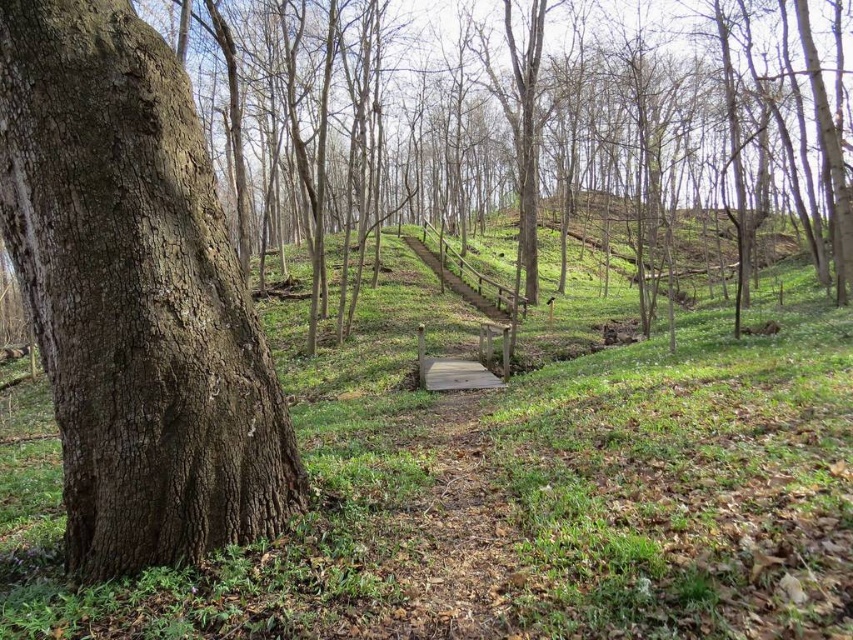
Can you confirm if green grassy at center is smaller than rough bark tree at left?

Indeed, green grassy at center has a smaller size compared to rough bark tree at left.

I want to click on green grassy at center, so click(x=505, y=484).

Which is behind, point (398, 573) or point (161, 541)?

Point (398, 573)

Does point (494, 522) lie in front of point (51, 138)?

No, (494, 522) is further to viewer.

Image resolution: width=853 pixels, height=640 pixels. Find the location of `green grassy at center`. green grassy at center is located at coordinates (505, 484).

Who is more distant from viewer, (450, 124) or (177, 492)?

Point (450, 124)

Does point (320, 4) come behind point (167, 371)?

Yes, it is.

The image size is (853, 640). Identify the location of rough bark tree at left. (524, 132).